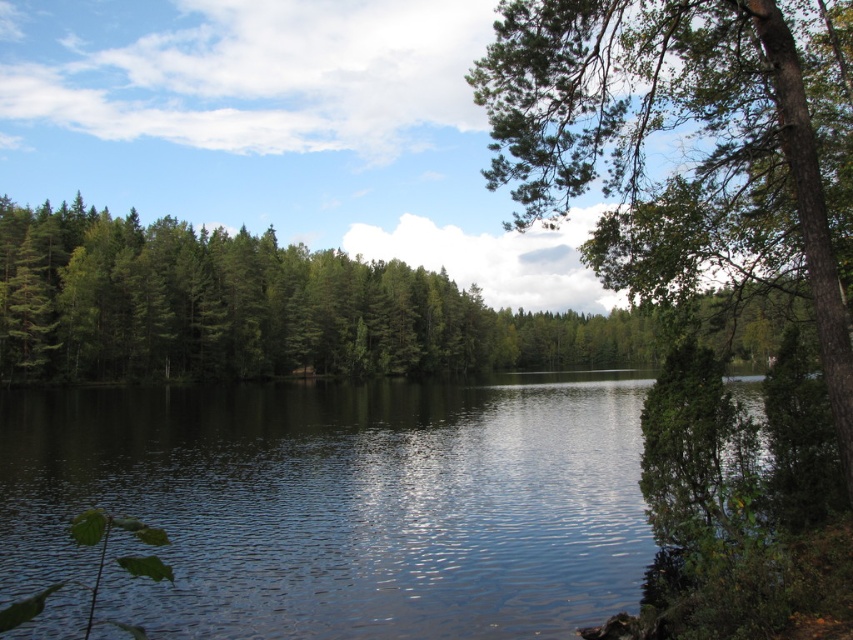
Is clear water at center closer to camera compared to green textured tree at upper right?

No, it is not.

The width and height of the screenshot is (853, 640). What do you see at coordinates (339, 502) in the screenshot? I see `clear water at center` at bounding box center [339, 502].

Who is more distant from viewer, (x=572, y=573) or (x=541, y=148)?

The point (x=572, y=573) is behind.

You are a GUI agent. You are given a task and a screenshot of the screen. Output one action in this format:
    pyautogui.click(x=<x>, y=<y>)
    Task: Click on the clear water at center
    Image resolution: width=853 pixels, height=640 pixels.
    Given the screenshot: What is the action you would take?
    pyautogui.click(x=339, y=502)